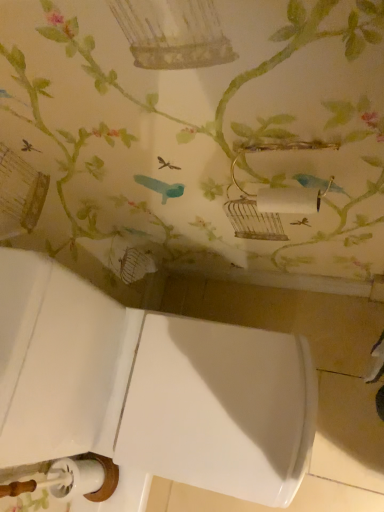
Image resolution: width=384 pixels, height=512 pixels. Identify the location of white glossy sink at lower left. (149, 388).

The width and height of the screenshot is (384, 512). Describe the element at coordinates (149, 388) in the screenshot. I see `white glossy sink at lower left` at that location.

Identify the location of white glossy sink at lower left. (149, 388).